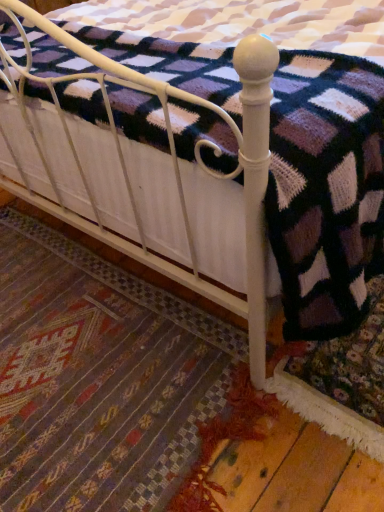
The image size is (384, 512). I want to click on carpeted floor at lower center, so click(x=99, y=378).

This screenshot has height=512, width=384. Describe the element at coordinates (99, 378) in the screenshot. I see `carpeted floor at lower center` at that location.

At what (x,y) coordinates should I click in order to perform the action: click on carpeted floor at lower center. Please return your answer as a coordinate pair (x, y). Looking at the image, I should click on (99, 378).